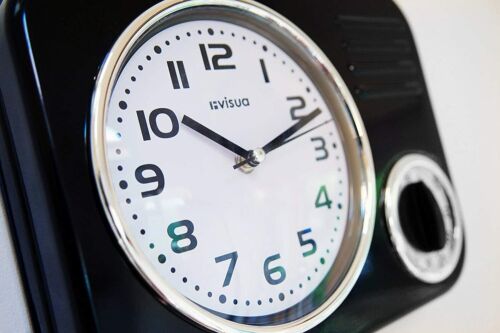
I want to click on glass cover, so click(x=317, y=189).